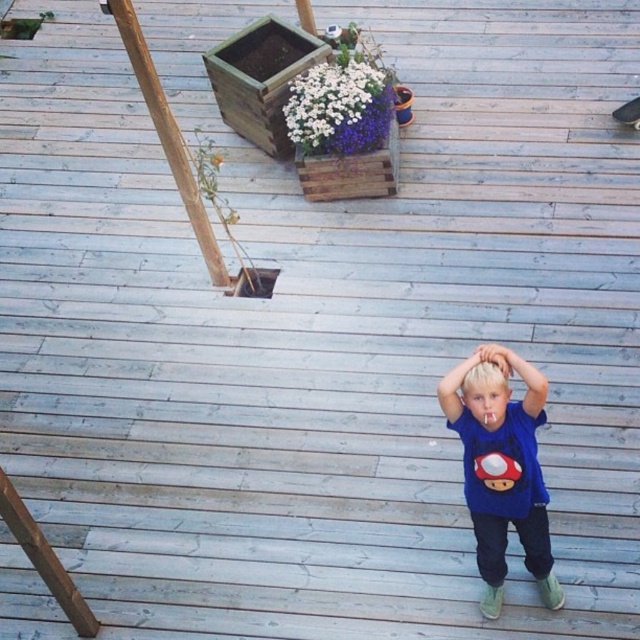
Question: Which point appears closest to the camera in this image?

Choices:
 (A) (474, 353)
 (B) (483, 532)
 (C) (483, 353)

Answer: (C)

Question: Which point is closer to the camera taking this photo?

Choices:
 (A) (486, 344)
 (B) (486, 392)

Answer: (B)

Question: Is blue cotton shirt at center below smooth skin hand at center?

Choices:
 (A) no
 (B) yes

Answer: (B)

Question: In this image, where is blonde hair at center located relative to smooth skin hand at center?

Choices:
 (A) above
 (B) below

Answer: (B)

Question: Which object is positioned closest to the blonde hair at center?

Choices:
 (A) blue cotton shirt at center
 (B) smooth skin hand at center

Answer: (B)

Question: Is blue cotton shirt at center to the right of smooth skin hand at center from the viewer's perspective?

Choices:
 (A) no
 (B) yes

Answer: (B)